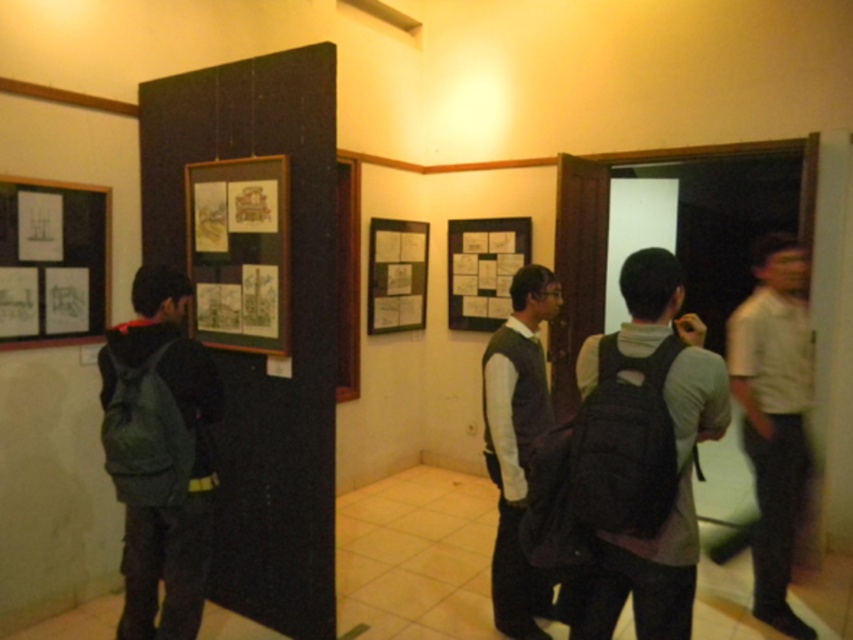
You are standing in the gallery and want to take a photo of both the white matte shirt at right and the matte paper poster at center without any obstruction. Given their height difference, which object should you adjust your camera angle to focus on first to ensure both are fully visible?

The white matte shirt at right is much taller than the matte paper poster at center. To capture both without obstruction, focus on the taller white matte shirt at right first, then adjust the angle to include the shorter matte paper poster at center.

You are standing in the gallery and want to take a photo of the point at coordinates (495,442). The camera has a minimum focus distance of 9 feet. Will the camera be able to focus on the point?

The point at coordinates (495,442) is 8.96 feet from the camera, which is less than the minimum focus distance of 9 feet. Therefore, the camera will not be able to focus on the point.

Looking at this image, you are an artist in the gallery looking to hang a new large canvas. You notice the white matte shirt at right and the matte paper poster at center. Which object is bigger in size?

The white matte shirt at right has a larger size compared to the matte paper poster at center.